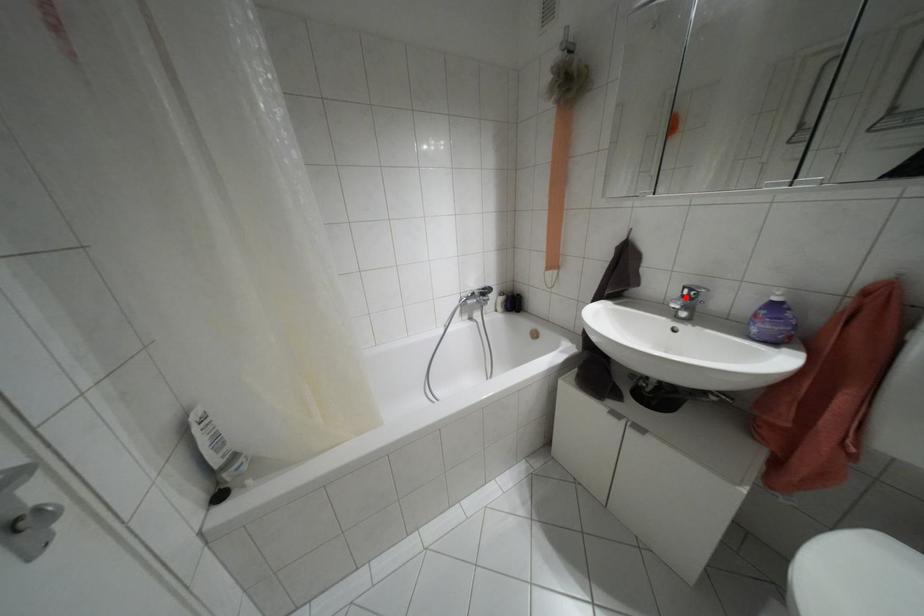
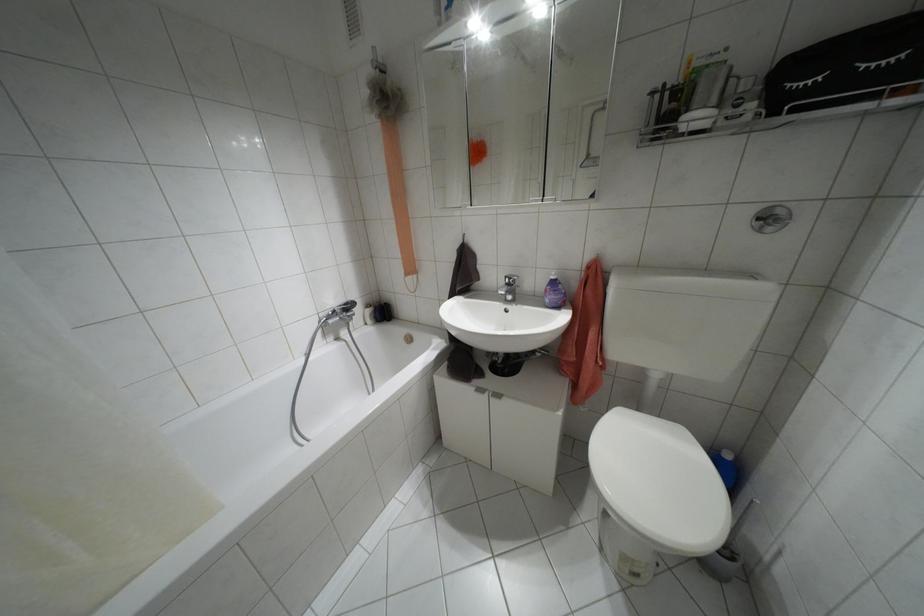
Find the pixel in the second image that matches the highlighted location in the first image.

(507, 284)